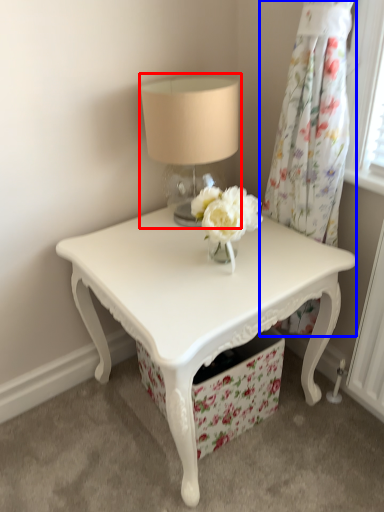
Question: Which point is further to the camera, table lamp (highlighted by a red box) or curtain (highlighted by a blue box)?

Choices:
 (A) table lamp
 (B) curtain

Answer: (A)